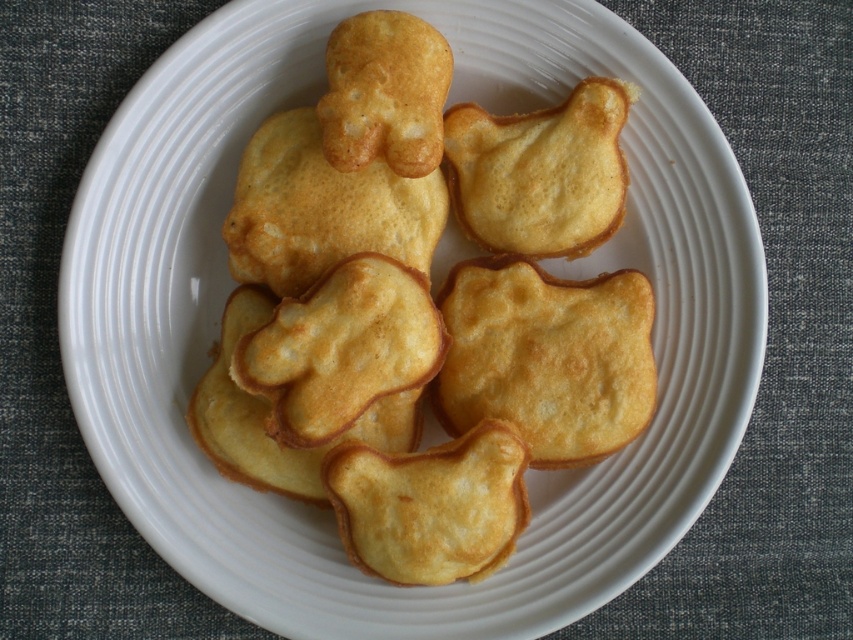
Question: Among these objects, which one is farthest from the camera?

Choices:
 (A) golden-brown crispy bear at center
 (B) golden crispy pastry at center
 (C) golden crispy cookie at center
 (D) golden crispy cat at center

Answer: (D)

Question: Which point is farther from the camera taking this photo?

Choices:
 (A) (306, 260)
 (B) (370, 323)
 (C) (498, 544)

Answer: (A)

Question: Is golden-brown crispy cat at center above golden crispy bear at center?

Choices:
 (A) no
 (B) yes

Answer: (B)

Question: Observing the image, what is the correct spatial positioning of golden crispy cat at center in reference to golden crispy cookie at center?

Choices:
 (A) right
 (B) left

Answer: (A)

Question: Estimate the real-world distances between objects in this image. Which object is farther from the golden crispy cookie at center?

Choices:
 (A) golden-brown crispy cat at center
 (B) golden-brown crispy bear at center
 (C) golden crispy bunny at center

Answer: (B)

Question: Can you confirm if golden crispy bunny at center is bigger than golden crispy bear at center?

Choices:
 (A) yes
 (B) no

Answer: (A)